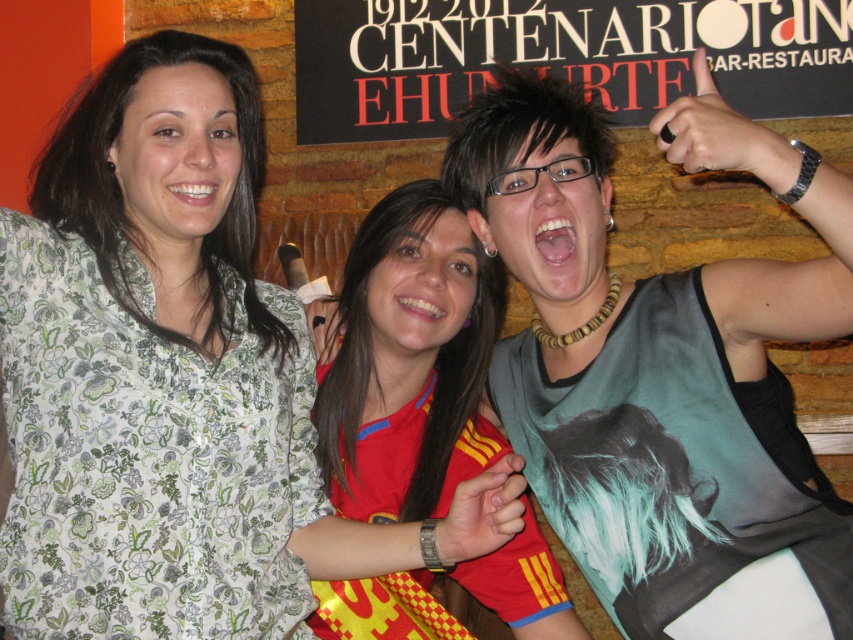
Is green printed tank top at right above red/yellow jersey at center?

Indeed, green printed tank top at right is positioned over red/yellow jersey at center.

Between green printed tank top at right and red/yellow jersey at center, which one appears on the left side from the viewer's perspective?

red/yellow jersey at center is more to the left.

This screenshot has height=640, width=853. Identify the location of green printed tank top at right. (662, 371).

Image resolution: width=853 pixels, height=640 pixels. I want to click on green printed tank top at right, so click(662, 371).

Can you confirm if floral-patterned shirt at center is taller than black cardboard sign at upper center?

Yes, floral-patterned shirt at center is taller than black cardboard sign at upper center.

Can you confirm if floral-patterned shirt at center is positioned to the left of black cardboard sign at upper center?

Yes, floral-patterned shirt at center is to the left of black cardboard sign at upper center.

Is point (215, 220) less distant than point (659, 96)?

Yes, point (215, 220) is in front of point (659, 96).

What are the coordinates of `floral-patterned shirt at center` in the screenshot? It's located at (173, 381).

From the picture: Between green printed tank top at right and black cardboard sign at upper center, which one has more height?

With more height is green printed tank top at right.

Is point (561, 144) positioned after point (450, 45)?

That is False.

Is point (486, 116) closer to viewer compared to point (671, 19)?

Yes.

Where is `green printed tank top at right`? The image size is (853, 640). green printed tank top at right is located at coordinates (662, 371).